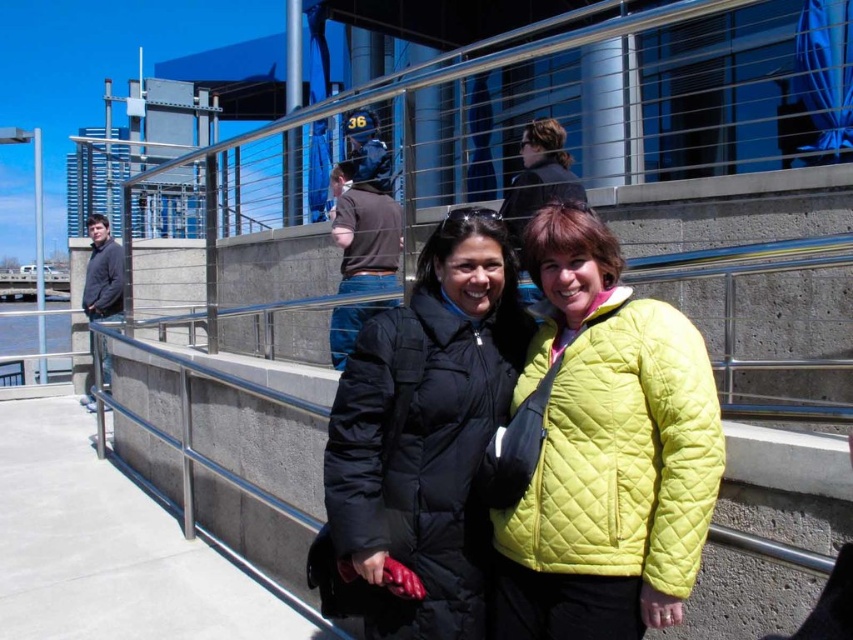
Is black quilted jacket at center shorter than dark gray quilted jacket at left?

No, black quilted jacket at center is not shorter than dark gray quilted jacket at left.

Which is in front, point (495, 346) or point (108, 314)?

Point (495, 346) is in front.

Is point (387, 584) behind point (106, 305)?

No, it is in front of (106, 305).

This screenshot has height=640, width=853. I want to click on black quilted jacket at center, so click(x=422, y=440).

Who is shorter, black quilted jacket at center or lime quilted jacket at center?

With less height is lime quilted jacket at center.

Who is positioned more to the right, black quilted jacket at center or lime quilted jacket at center?

lime quilted jacket at center is more to the right.

Is point (430, 284) farther from viewer compared to point (534, 502)?

That is True.

Locate an element on the screen. The image size is (853, 640). black quilted jacket at center is located at coordinates (422, 440).

Can you confirm if lime quilted jacket at center is wider than dark gray quilted jacket at left?

Incorrect, lime quilted jacket at center's width does not surpass dark gray quilted jacket at left's.

Is lime quilted jacket at center below dark gray quilted jacket at left?

Yes, lime quilted jacket at center is below dark gray quilted jacket at left.

The width and height of the screenshot is (853, 640). What do you see at coordinates (618, 448) in the screenshot? I see `lime quilted jacket at center` at bounding box center [618, 448].

Identify the location of lime quilted jacket at center. (618, 448).